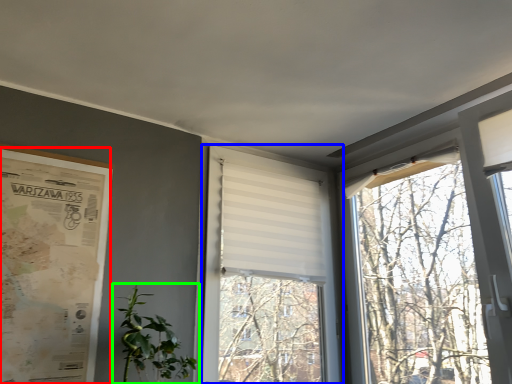
Question: Based on their relative distances, which object is farther from poster page (highlighted by a red box)? Choose from window (highlighted by a blue box) and houseplant (highlighted by a green box).

Choices:
 (A) window
 (B) houseplant

Answer: (A)